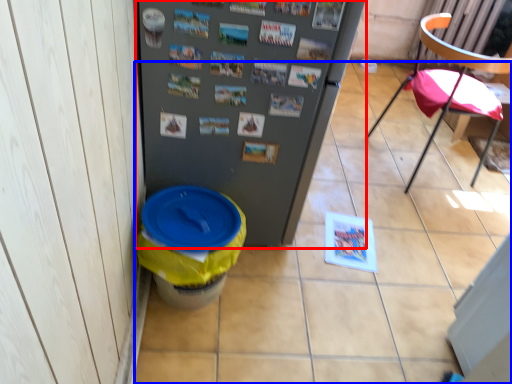
Question: Which object appears farthest to the camera in this image, refrigerator (highlighted by a red box) or tile (highlighted by a blue box)?

Choices:
 (A) refrigerator
 (B) tile

Answer: (B)